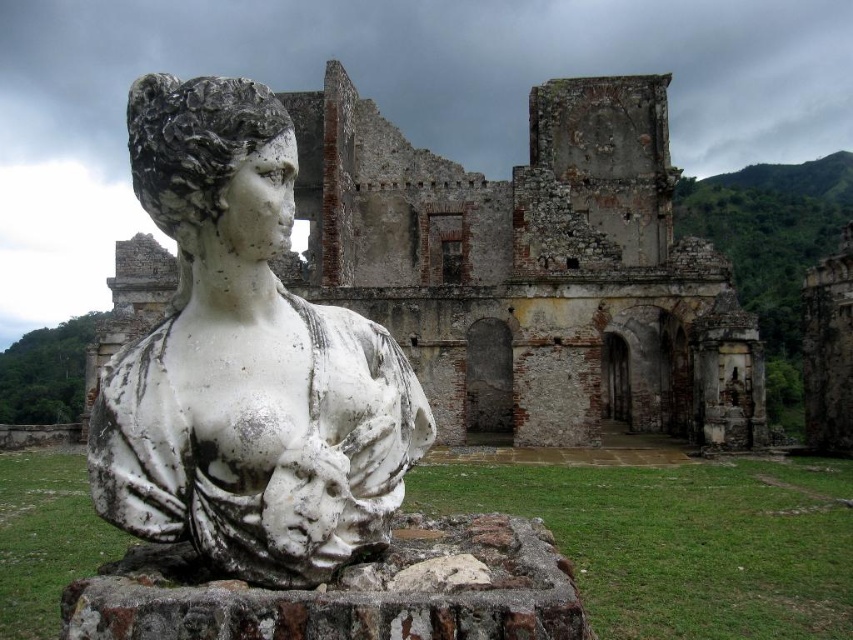
You are an archaeologist examining the image. You notice a coordinate point marked at (531, 269). Based on the scene description, what does this point most likely represent?

The point at (531, 269) indicates weathered stone ruins at center.

You are an archaeologist examining the site. You notice the weathered stone ruins at center and the white marble bust at center. Based on their positions, which one is situated higher in the image?

The weathered stone ruins at center is above the white marble bust at center, so it is situated higher in the image.

In the scene shown: You are an archaeologist examining the weathered stone ruins at center and the white marble bust at center. Which object is wider?

The weathered stone ruins at center is wider than the white marble bust at center.